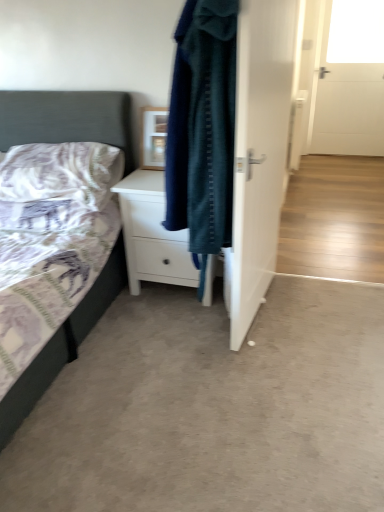
Question: From a real-world perspective, is white matte chest of drawers at center physically above transparent glass window at upper right?

Choices:
 (A) yes
 (B) no

Answer: (B)

Question: From the image's perspective, is white matte chest of drawers at center over transparent glass window at upper right?

Choices:
 (A) yes
 (B) no

Answer: (B)

Question: Is white matte chest of drawers at center next to transparent glass window at upper right and touching it?

Choices:
 (A) no
 (B) yes

Answer: (A)

Question: Does white matte chest of drawers at center contain transparent glass window at upper right?

Choices:
 (A) yes
 (B) no

Answer: (B)

Question: From the image's perspective, is white matte chest of drawers at center located beneath transparent glass window at upper right?

Choices:
 (A) no
 (B) yes

Answer: (B)

Question: From a real-world perspective, is matte wooden picture frame at center physically located above or below textured fabric bed at left?

Choices:
 (A) below
 (B) above

Answer: (B)

Question: In the image, is matte wooden picture frame at center on the left side or the right side of textured fabric bed at left?

Choices:
 (A) left
 (B) right

Answer: (B)

Question: Relative to textured fabric bed at left, is matte wooden picture frame at center in front or behind?

Choices:
 (A) front
 (B) behind

Answer: (B)

Question: Looking at their shapes, would you say matte wooden picture frame at center is wider or thinner than textured fabric bed at left?

Choices:
 (A) thin
 (B) wide

Answer: (A)

Question: Choose the correct answer: Is white glossy door at center inside textured fabric bed at left or outside it?

Choices:
 (A) inside
 (B) outside

Answer: (B)

Question: Is white glossy door at center taller or shorter than textured fabric bed at left?

Choices:
 (A) tall
 (B) short

Answer: (A)

Question: In the image, is white glossy door at center positioned in front of or behind textured fabric bed at left?

Choices:
 (A) front
 (B) behind

Answer: (B)

Question: Is white glossy door at center bigger or smaller than textured fabric bed at left?

Choices:
 (A) small
 (B) big

Answer: (A)

Question: In the image, is white matte chest of drawers at center positioned in front of or behind purple cotton pillow at left?

Choices:
 (A) behind
 (B) front

Answer: (A)

Question: From a real-world perspective, is white matte chest of drawers at center positioned above or below purple cotton pillow at left?

Choices:
 (A) below
 (B) above

Answer: (A)